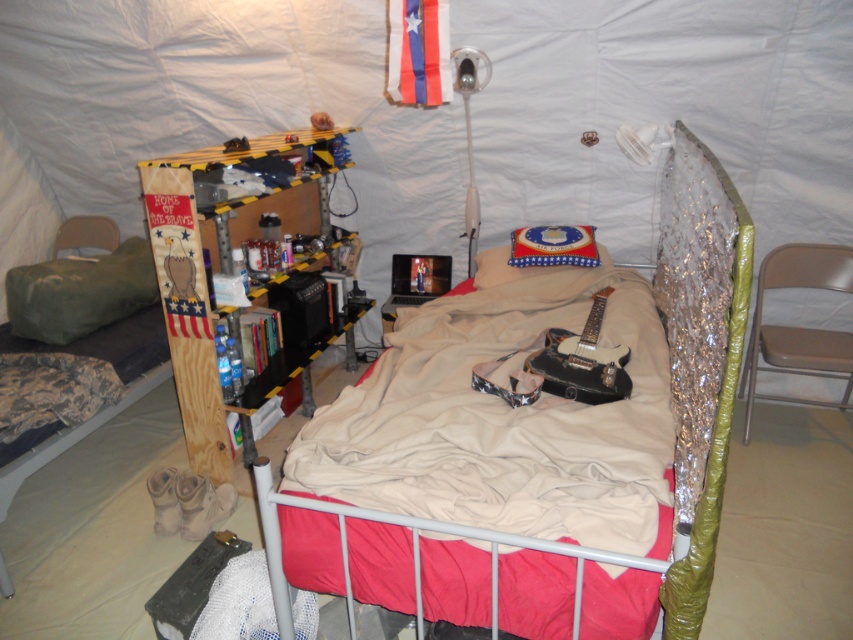
You are inside the tent and want to place a small item on the point that is closer to you. Which point should you choose between point (677, 205) and point (64, 268)?

You should choose point (677, 205) because it is closer to the viewer than point (64, 268).

You are setting up a temporary shelter and need to place a metallic silver bed at center and a green fabric pillow at left. According to the scene, which object is positioned to the right of the other?

The metallic silver bed at center is to the right of green fabric pillow at left.